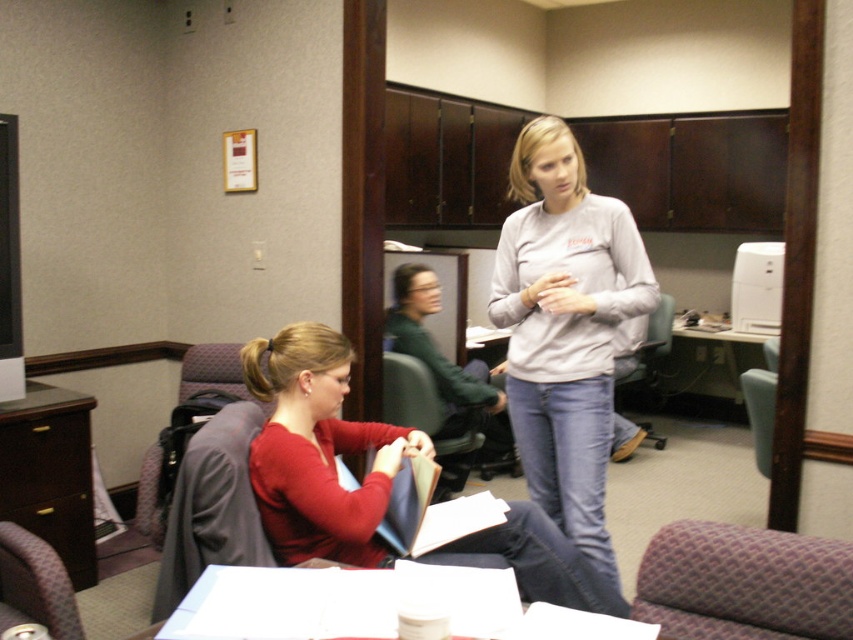
You are trying to decide whether to place a new plant on the matte gray sweatshirt at center or the white glossy table at center. Which surface is more suitable for placing the plant?

The white glossy table at center is more suitable for placing the plant since the matte gray sweatshirt at center is much taller than the table, meaning the sweatshirt would block sunlight or access to the plant.

You are organizing a craft project and need to decide which material to use for a sculpture. You have the matte gray sweatshirt at center and the white paper at center. Which material is thinner and more suitable for folding?

The matte gray sweatshirt at center is thinner than the white paper at center, so it would be more suitable for folding.

Consider the image. You are organizing a charity event and need to display two items on a shelf. The shelf has limited vertical space. Which item between the matte gray sweatshirt at center and the matte red sweater at center should you place first to ensure both fit vertically?

The matte red sweater at center should be placed first since it is shorter in height compared to the matte gray sweatshirt at center, allowing more space for the taller item above it.